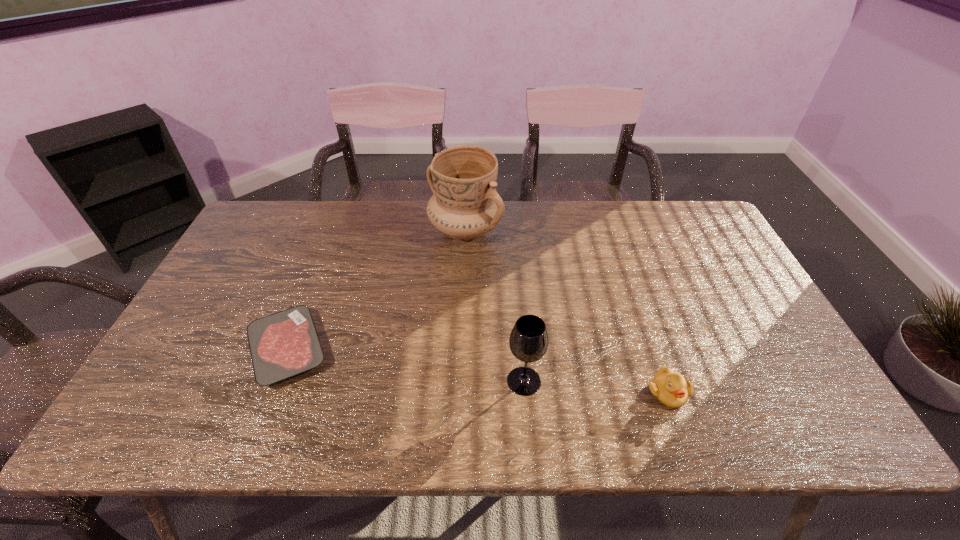
Identify the location of free space located 0.120m on the back of the shortest object. (314, 281).

I want to click on object at the far edge, so click(x=465, y=205).

Identify the location of object that is at the near edge. (670, 388).

This screenshot has width=960, height=540. I want to click on vacant position at the far edge of the desktop, so click(x=662, y=231).

In the image, there is a desktop. In order to click on vacant space at the near edge in this screenshot , I will do `click(286, 416)`.

This screenshot has width=960, height=540. In the image, there is a desktop. In order to click on vacant space at the left edge in this screenshot , I will do `click(238, 259)`.

Locate an element on the screen. This screenshot has height=540, width=960. vacant space at the right edge is located at coordinates (731, 270).

Find the location of a particular element. This screenshot has height=540, width=960. vacant space at the far right corner is located at coordinates (710, 233).

At what (x,y) coordinates should I click in order to perform the action: click on vacant space that's between the wineglass and the rightmost object. Please return your answer as a coordinate pair (x, y). Looking at the image, I should click on (596, 387).

Where is `empty space between the duckling and the wineglass`? The image size is (960, 540). empty space between the duckling and the wineglass is located at coordinates (596, 387).